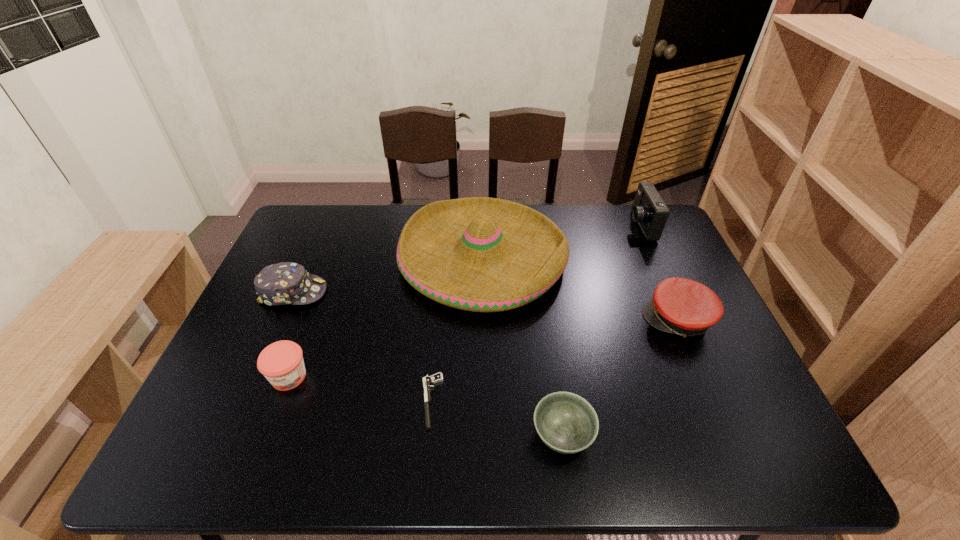
The height and width of the screenshot is (540, 960). In order to click on vacant space at the right edge of the desktop in this screenshot , I will do `click(698, 357)`.

Where is `vacant area at the far left corner of the desktop`? This screenshot has width=960, height=540. vacant area at the far left corner of the desktop is located at coordinates (291, 228).

Where is `free space at the far right corner`? free space at the far right corner is located at coordinates (635, 240).

At what (x,y) coordinates should I click in order to perform the action: click on free spot between the shortest object and the sombrero. Please return your answer as a coordinate pair (x, y). Looking at the image, I should click on (457, 329).

Identify the location of vacant area that lies between the tallest object and the jam. (386, 317).

Locate an element on the screen. The height and width of the screenshot is (540, 960). free space between the tallest object and the right cap is located at coordinates (580, 289).

Where is `free spot between the left cap and the jam`? The width and height of the screenshot is (960, 540). free spot between the left cap and the jam is located at coordinates (291, 334).

Locate an element on the screen. The image size is (960, 540). free point between the right cap and the shortest object is located at coordinates (555, 361).

Where is `vacant space that is in between the sombrero and the jam`? vacant space that is in between the sombrero and the jam is located at coordinates (386, 317).

You are a GUI agent. You are given a task and a screenshot of the screen. Output one action in this format:
    pyautogui.click(x=<x>, y=<y>)
    Task: Click on the vacant space that is in between the shortest object and the camera
    
    Given the screenshot: What is the action you would take?
    pyautogui.click(x=536, y=314)